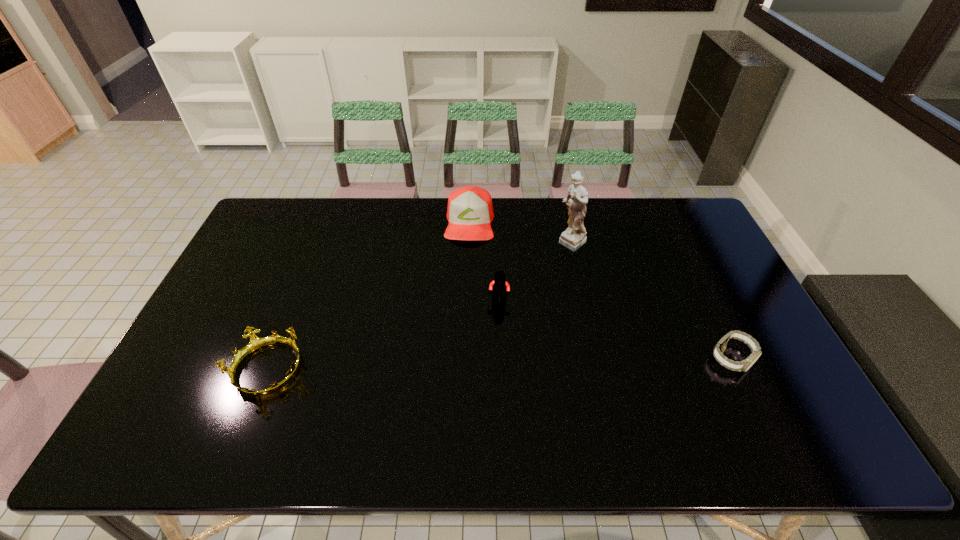
You are a GUI agent. You are given a task and a screenshot of the screen. Output one action in this format:
    pyautogui.click(x=<x>, y=<y>)
    Task: Click on the object that is at the right edge
    Image resolution: width=960 pixels, height=540 pixels.
    Given the screenshot: What is the action you would take?
    pyautogui.click(x=744, y=365)

Find the location of a particular element. This screenshot has width=960, height=540. object situated at the near left corner is located at coordinates (256, 343).

You are a GUI agent. You are given a task and a screenshot of the screen. Output one action in this format:
    pyautogui.click(x=<x>, y=<y>)
    Task: Click on the vacant position at the far edge of the desktop
    The image size is (960, 540).
    Given the screenshot: What is the action you would take?
    pyautogui.click(x=599, y=206)

Find the location of a particular element. vacant position at the near edge of the desktop is located at coordinates (587, 393).

In the image, there is a desktop. Where is `blank space at the left edge`? The image size is (960, 540). blank space at the left edge is located at coordinates (228, 322).

In the image, there is a desktop. What are the coordinates of `vacant space at the right edge` in the screenshot? It's located at (739, 299).

In the image, there is a desktop. Where is `vacant space at the far left corner`? The width and height of the screenshot is (960, 540). vacant space at the far left corner is located at coordinates (274, 230).

Find the location of a particular element. unoccupied area between the Lego and the crown is located at coordinates (383, 335).

In order to click on blank region between the rightmost object and the baseball cap in this screenshot , I will do `click(600, 291)`.

At what (x,y) coordinates should I click in order to perform the action: click on free area in between the fourth object from left to right and the leftmost object. Please return your answer as a coordinate pair (x, y). Looking at the image, I should click on (420, 307).